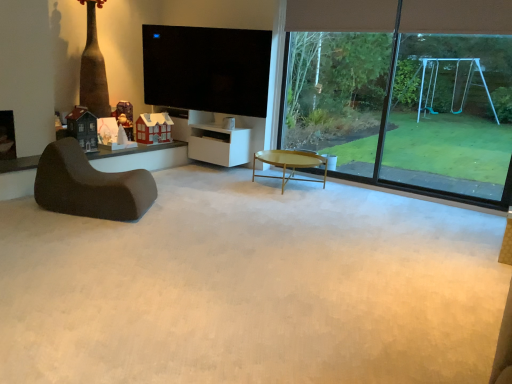
Question: In terms of width, does white matte cabinet at center look wider or thinner when compared to dark brown fabric chair at left?

Choices:
 (A) wide
 (B) thin

Answer: (B)

Question: Looking at the image, does white matte cabinet at center seem bigger or smaller compared to dark brown fabric chair at left?

Choices:
 (A) small
 (B) big

Answer: (A)

Question: Based on their relative distances, which object is farther from the white matte cabinet at center?

Choices:
 (A) flat screen tv at upper center
 (B) gold metallic coffee table at center
 (C) dark brown fabric chair at left
 (D) matte black house at left, which is the first toy from left to right
 (E) wooden santa at center, arranged as the 3th toy when viewed from the front

Answer: (C)

Question: Which object is positioned farthest from the green leafy tree at upper right?

Choices:
 (A) white paper house at center, the second toy positioned from the front
 (B) transparent glass window at upper right
 (C) flat screen tv at upper center
 (D) wooden santa at center, arranged as the 3th toy when viewed from the front
 (E) white matte cabinet at center

Answer: (D)